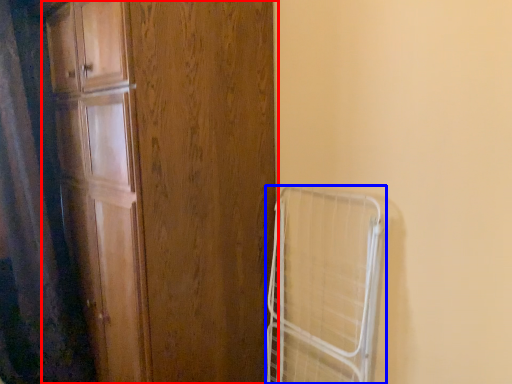
Question: Which point is further to the camera, door (highlighted by a red box) or cage (highlighted by a blue box)?

Choices:
 (A) door
 (B) cage

Answer: (B)